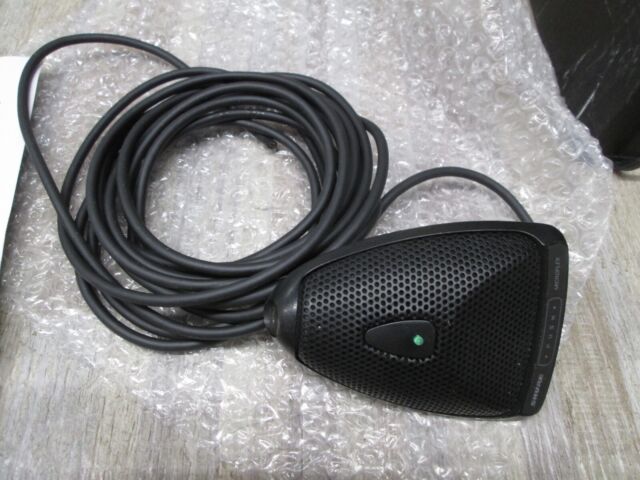
At what (x,y) coordinates should I click in order to perform the action: click on green light. Please return your answer as a coordinate pair (x, y). The width and height of the screenshot is (640, 480). Looking at the image, I should click on (417, 339).